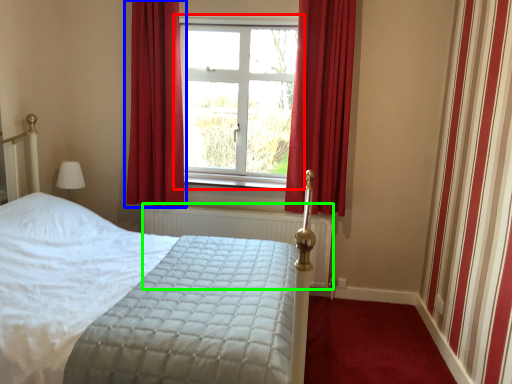
Question: Considering the real-world distances, which object is closest to window (highlighted by a red box)? curtain (highlighted by a blue box) or radiator (highlighted by a green box).

Choices:
 (A) curtain
 (B) radiator

Answer: (A)